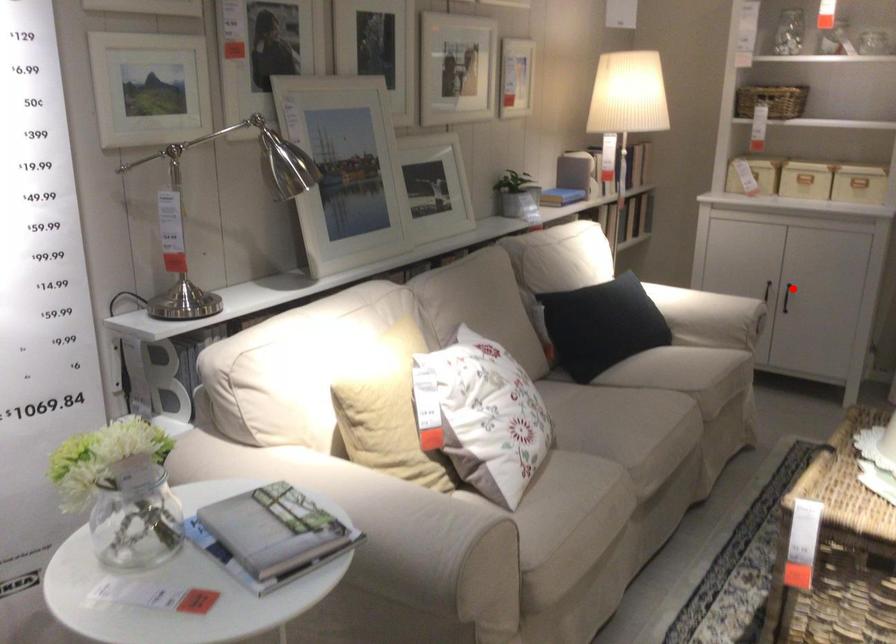
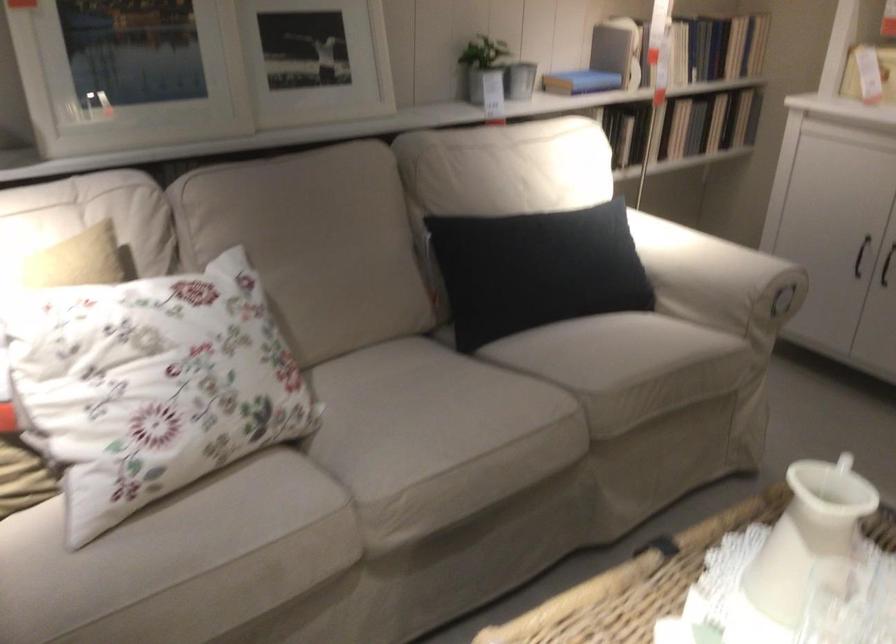
Question: I am providing you with two images of the same scene from different viewpoints. A red point is shown in image1. For the corresponding object point in image2, is it positioned nearer or farther from the camera?

Choices:
 (A) Nearer
 (B) Farther

Answer: (A)